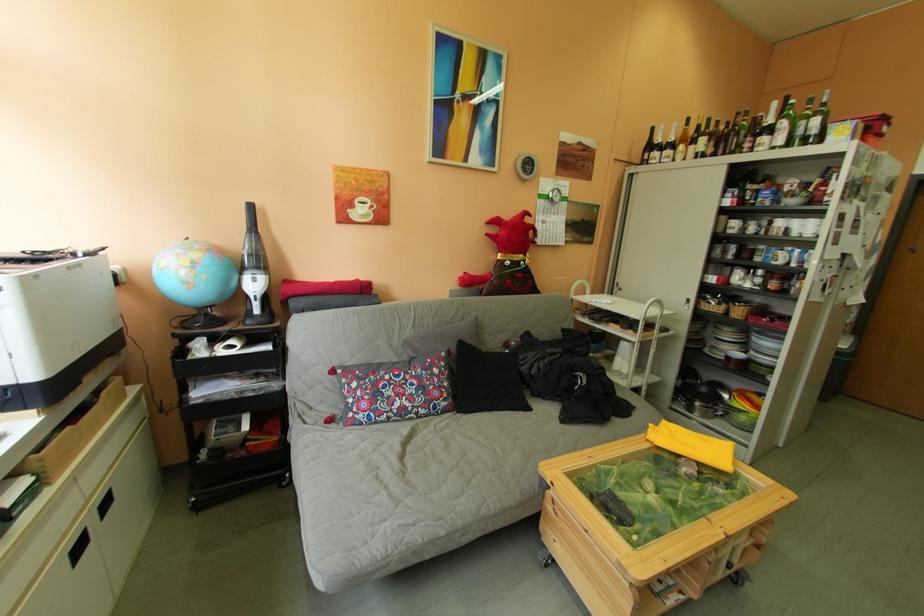
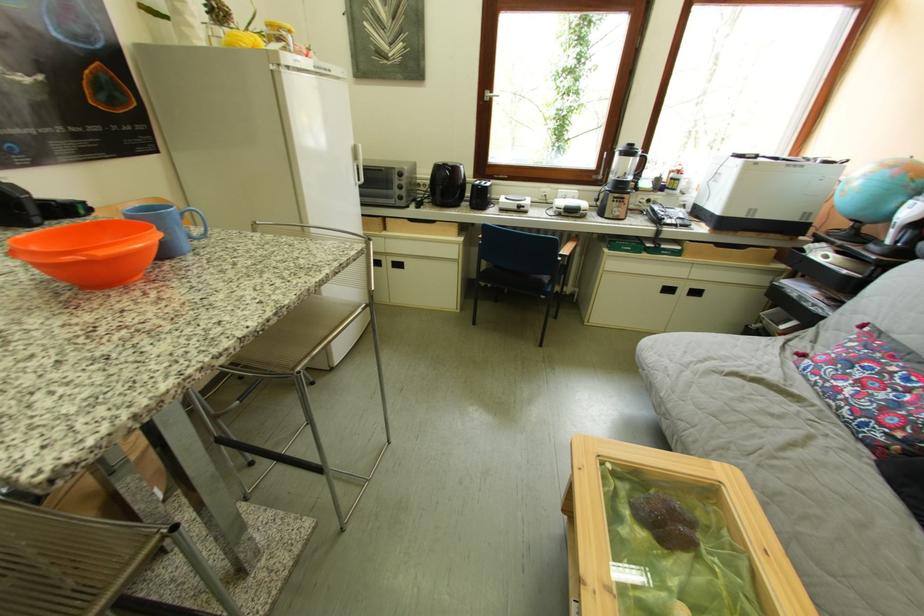
The point at (404, 413) is marked in the first image. Where is the corresponding point in the second image?

(841, 384)